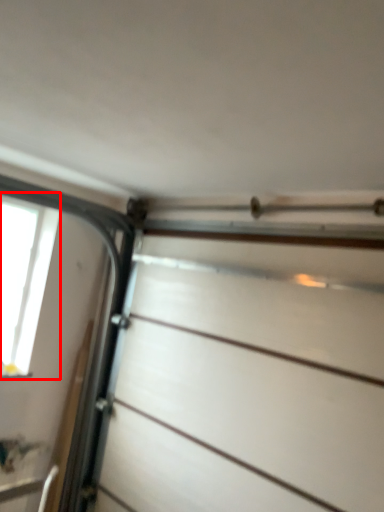
Question: From the image's perspective, where is window (annotated by the red box) located in relation to drawer in the image?

Choices:
 (A) below
 (B) above

Answer: (B)